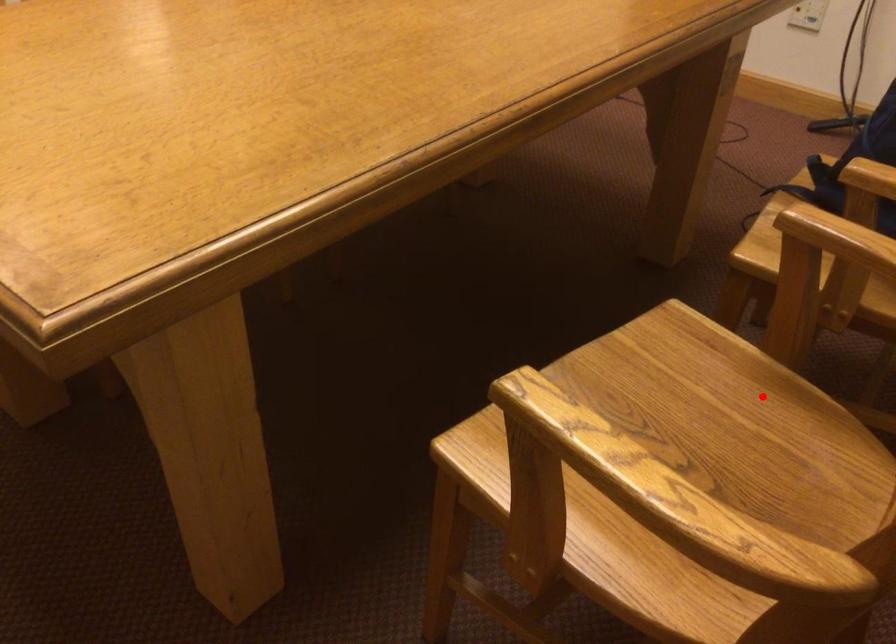
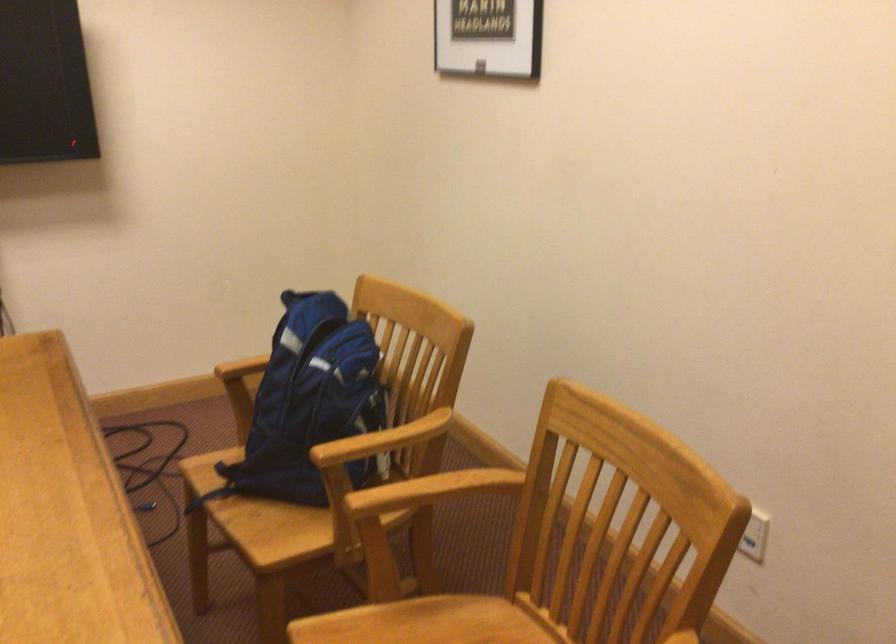
Locate, in the second image, the point that corresponds to the highlighted location in the first image.

(415, 627)